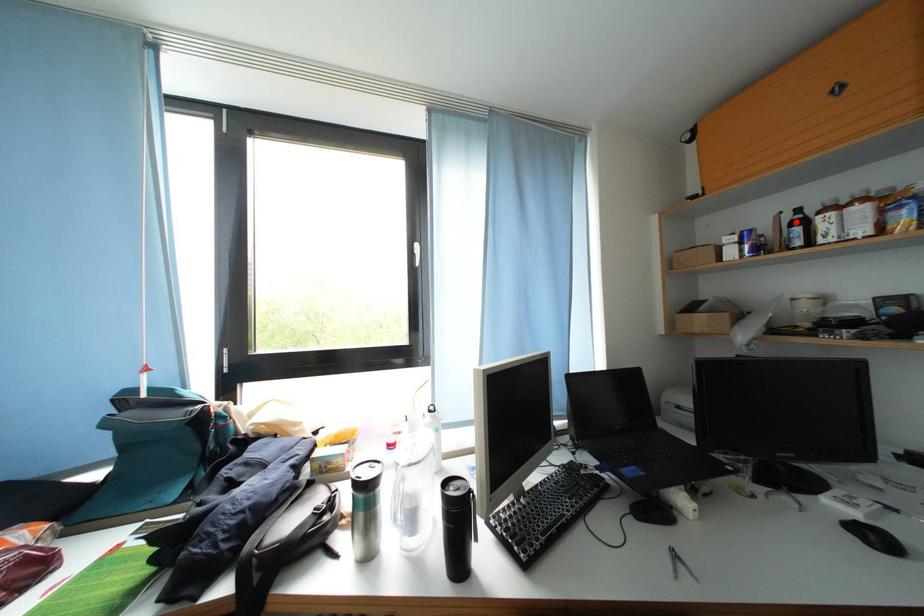
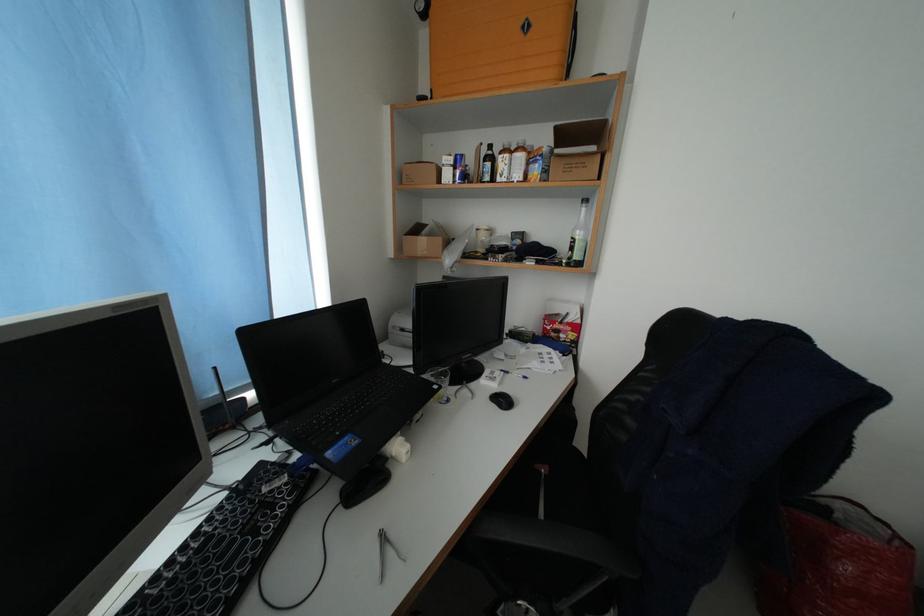
Locate, in the second image, the point that corresponds to the highlighted location in the first image.

(492, 156)